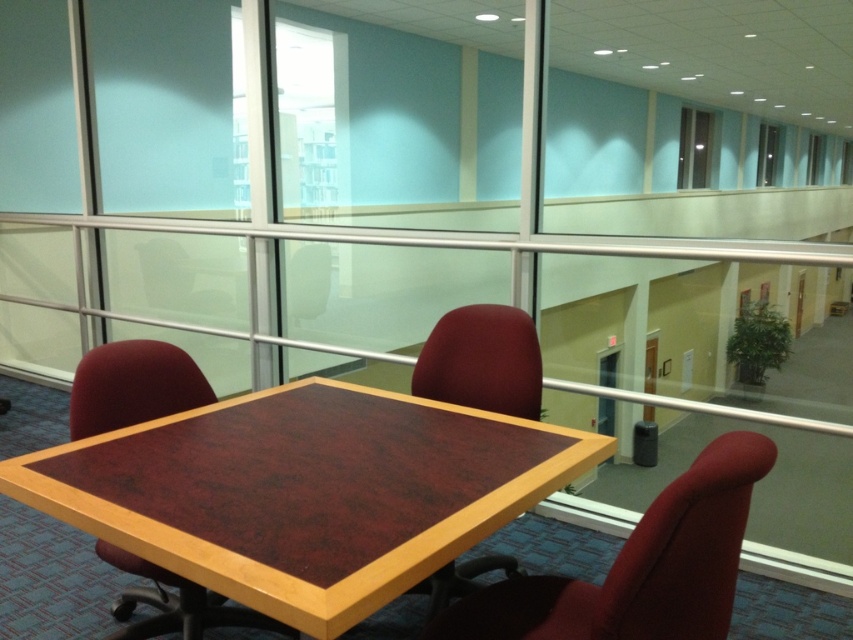
You are sitting at the table and need to reach both the matte red swivel chair at center and the mahogany wood chair at center. Which chair is closer to your current position?

The mahogany wood chair at center is closer to your current position because the matte red swivel chair at center is to the right of it, meaning it is further away.

You are standing on the balcony looking down into the office. You see a mahogany wood chair at center and a matte wood chair at center. Which chair is closer to you?

The mahogany wood chair at center is closer to you because it is below the matte wood chair at center, meaning the matte wood chair is further away.

You are standing at the point labeled as point (157,374) in the office scene. You want to walk towards the point labeled as point (502,593). Which direction should you move relative to your current position?

Since point (502,593) is in front of point (157,374), you should move forward in the direction towards the point (502,593).